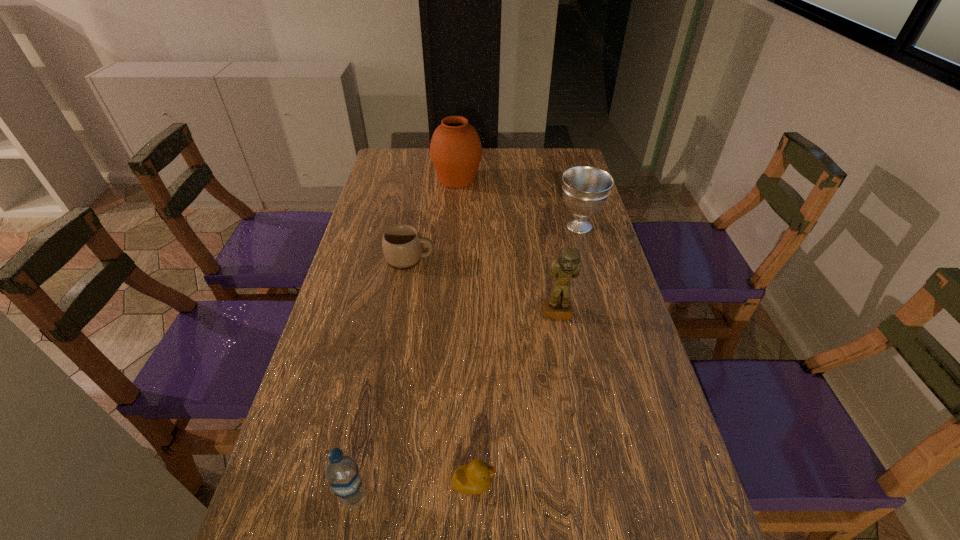
At what (x,y) coordinates should I click in order to perform the action: click on free space between the figurine and the farthest object. Please return your answer as a coordinate pair (x, y). Looking at the image, I should click on (507, 247).

Where is `empty space that is in between the water bottle and the duckling`? The height and width of the screenshot is (540, 960). empty space that is in between the water bottle and the duckling is located at coordinates (x=414, y=490).

You are a GUI agent. You are given a task and a screenshot of the screen. Output one action in this format:
    pyautogui.click(x=<x>, y=<y>)
    Task: Click on the vacant region between the water bottle and the farthest object
    Image resolution: width=960 pixels, height=540 pixels.
    Given the screenshot: What is the action you would take?
    pyautogui.click(x=405, y=338)

Point out which object is positioned as the fifth nearest to the rightmost object. Please provide its 2D coordinates. Your answer should be formatted as a tuple, i.e. [(x, y)], where the tuple contains the x and y coordinates of a point satisfying the conditions above.

[(341, 469)]

The height and width of the screenshot is (540, 960). I want to click on object that is the fourth closest to the third farthest object, so click(474, 478).

Where is `free spot that satisfies the following two spatial constraints: 1. on the front side of the second farthest object; 2. on the right side of the farthest object`? free spot that satisfies the following two spatial constraints: 1. on the front side of the second farthest object; 2. on the right side of the farthest object is located at coordinates (454, 226).

Find the location of a particular element. The image size is (960, 540). blank area in the image that satisfies the following two spatial constraints: 1. on the side of the second shortest object with the handle; 2. on the label of the water bottle is located at coordinates (367, 497).

Find the location of a particular element. The width and height of the screenshot is (960, 540). free location that satisfies the following two spatial constraints: 1. on the face of the duckling; 2. on the label of the water bottle is located at coordinates coord(473,497).